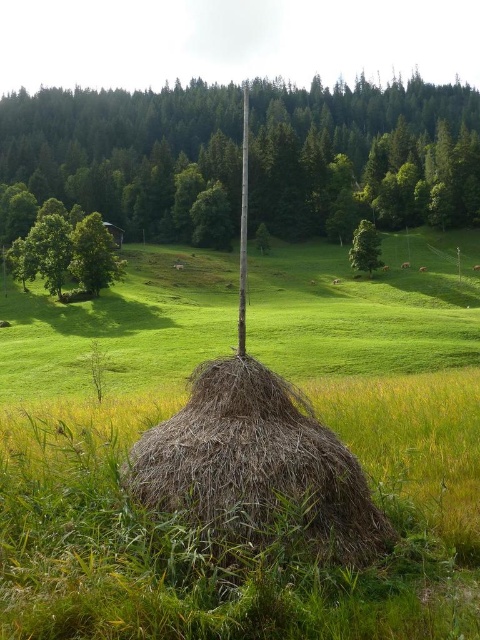
Question: Considering the real-world distances, which object is closest to the brown rough pole at center?

Choices:
 (A) smooth wood pole at center
 (B) green leafy tree at left

Answer: (A)

Question: Among these points, which one is nearest to the camera?

Choices:
 (A) (375, 237)
 (B) (100, 280)

Answer: (B)

Question: Does brown rough pole at center have a lesser width compared to dry straw bale at center?

Choices:
 (A) yes
 (B) no

Answer: (B)

Question: Does smooth wood pole at center appear on the left side of green leafy tree at center?

Choices:
 (A) yes
 (B) no

Answer: (A)

Question: Which of the following is the closest to the observer?

Choices:
 (A) dry straw bale at center
 (B) brown rough pole at center
 (C) smooth wood pole at center
 (D) green leafy tree at center

Answer: (A)

Question: Is brown rough pole at center smaller than green leafy tree at center?

Choices:
 (A) no
 (B) yes

Answer: (A)